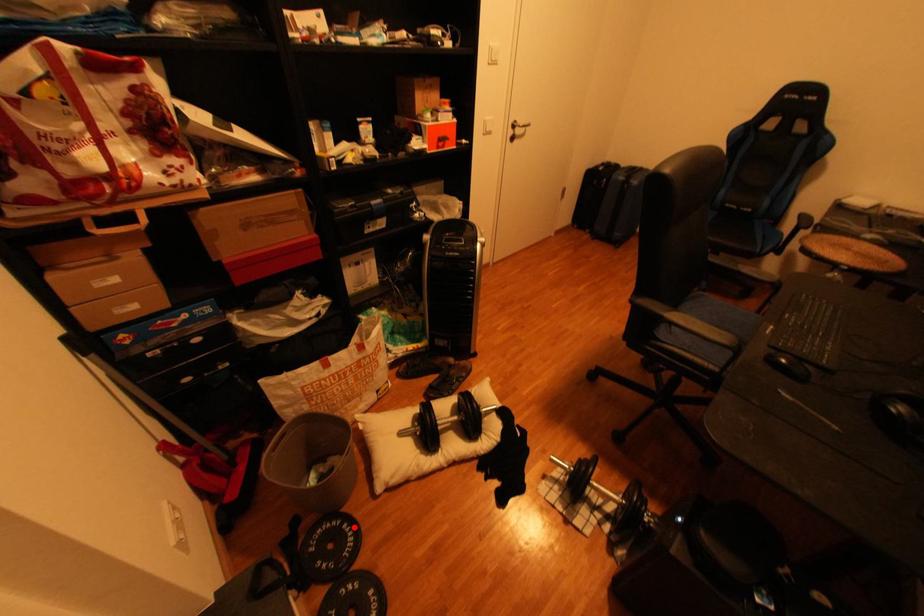
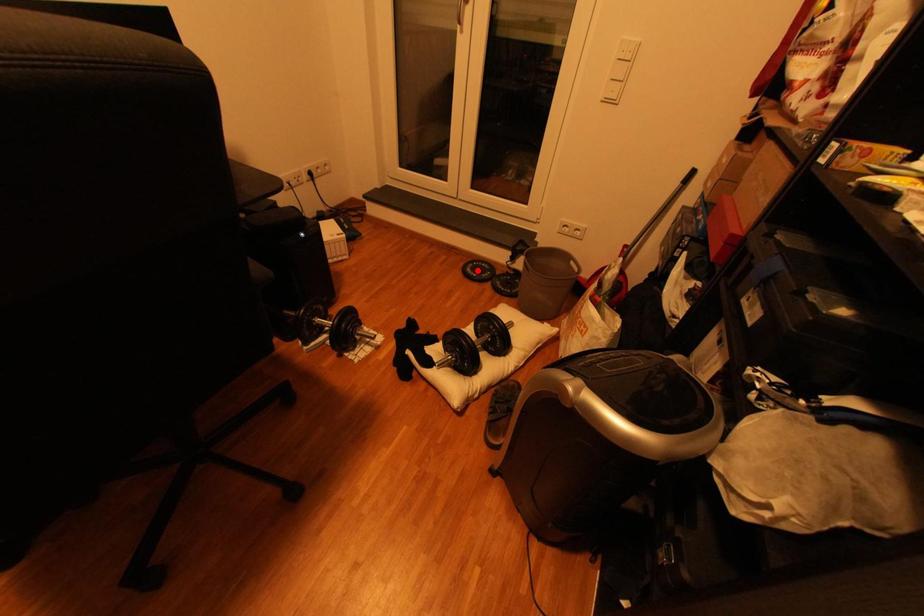
I am providing you with two images of the same scene from different viewpoints. A red point is marked on the first image and another point is marked on the second image. Is the marked point in image1 the same physical position as the marked point in image2?

No